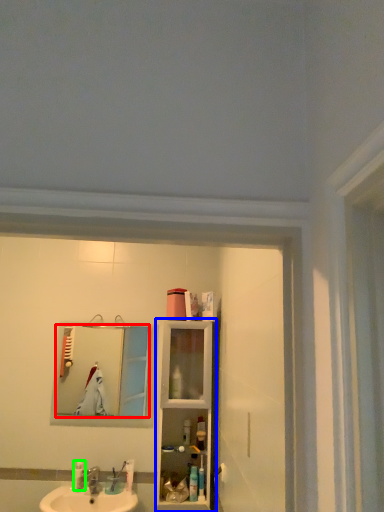
Question: Which is nearer to the mirror (highlighted by a red box)? cabinet (highlighted by a blue box) or toiletry (highlighted by a green box).

Choices:
 (A) cabinet
 (B) toiletry

Answer: (B)